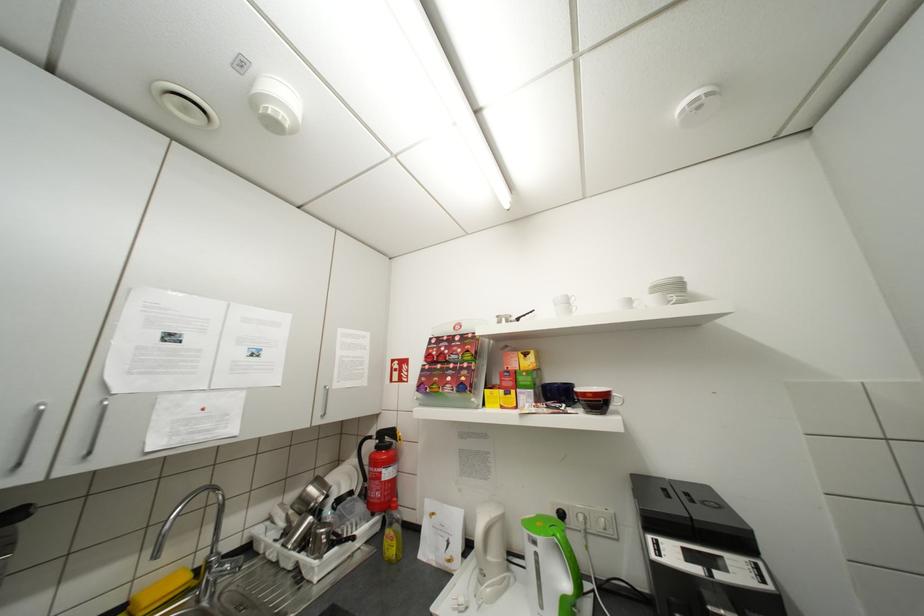
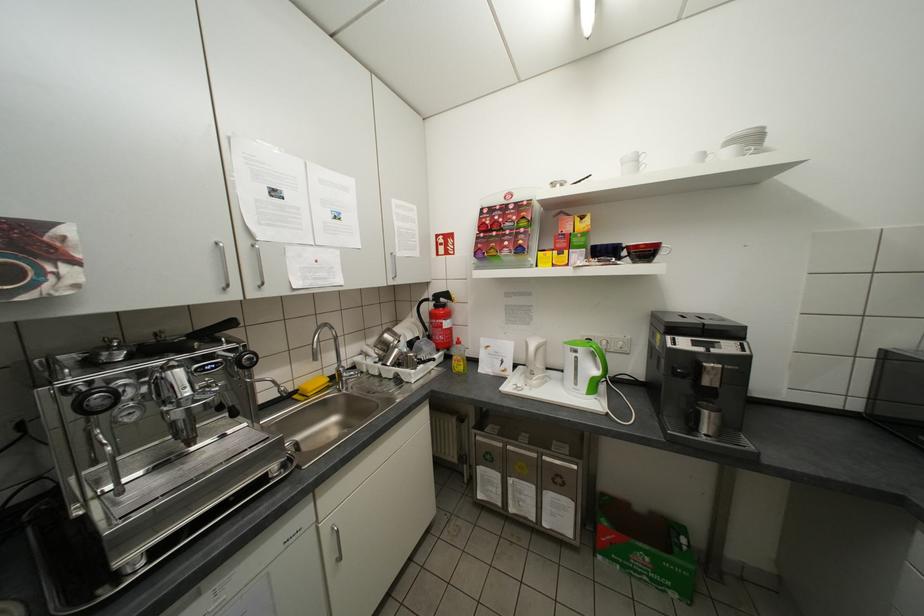
Find the pixel in the second image that matches point (564, 306) in the first image.

(630, 166)